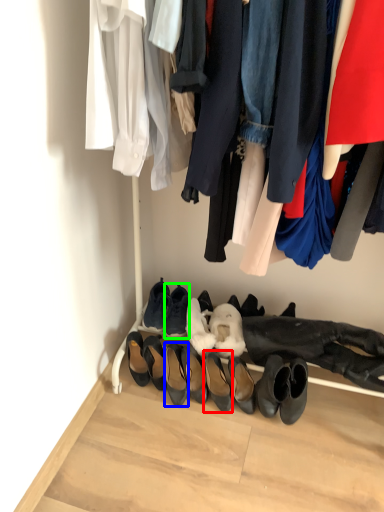
Question: Which object is positioned farthest from footwear (highlighted by a red box)? Select from footwear (highlighted by a blue box) and footwear (highlighted by a green box).

Choices:
 (A) footwear
 (B) footwear

Answer: (B)